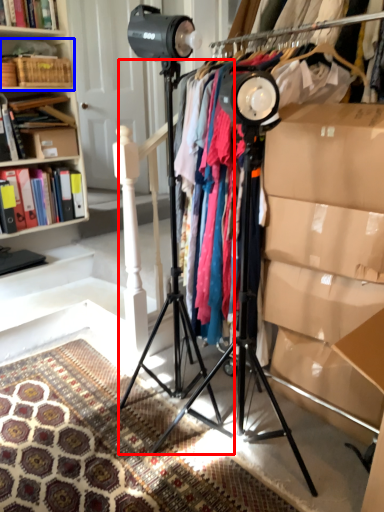
Question: Which object is further to the camera taking this photo, tripod (highlighted by a red box) or shelf (highlighted by a blue box)?

Choices:
 (A) tripod
 (B) shelf

Answer: (B)